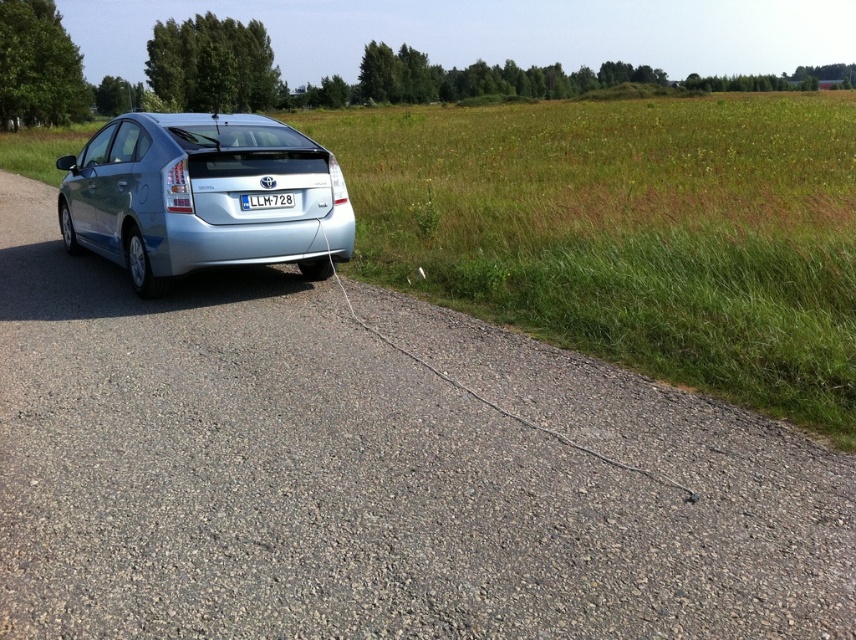
You are a delivery driver who needs to park your car on the asphalt road next to the grassy field. You see the satin silver sedan at center and the white plastic license plate at center. Which object should you avoid driving over to prevent damage to your vehicle?

The satin silver sedan at center is positioned over the white plastic license plate at center. Therefore, you should avoid driving over the satin silver sedan at center to prevent damage to your vehicle.

You are a photographer trying to capture the satin silver sedan at center and the white plastic license plate at center in a single shot. Based on their positions, which object would appear larger in the photo?

The satin silver sedan at center would appear larger in the photo because it is closer to the viewer than the white plastic license plate at center.

You are a driver who just arrived at a parking lot. You see a silver Toyota Prius parked at point [201,196]. Can you park your car in the parking lot without crossing the grassy field?

The satin silver sedan at center is located at point [201,196]. Since the parking lot is paved road adjacent to the grassy field, you can park your car in the parking lot without crossing the grassy field by driving on the paved road.